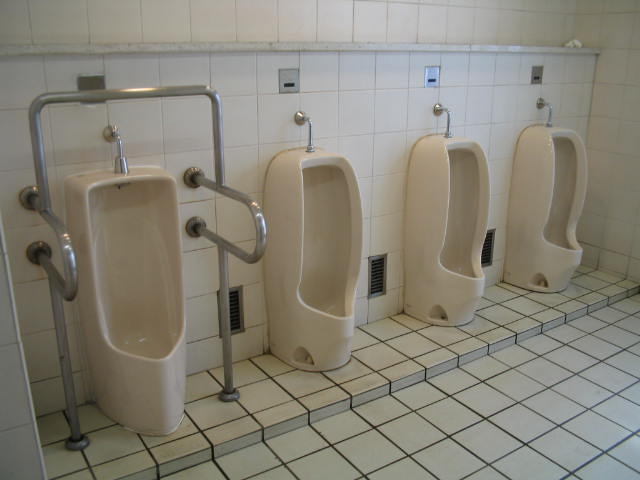
I want to click on flush sensor, so click(290, 73), click(431, 76), click(539, 72), click(91, 82).